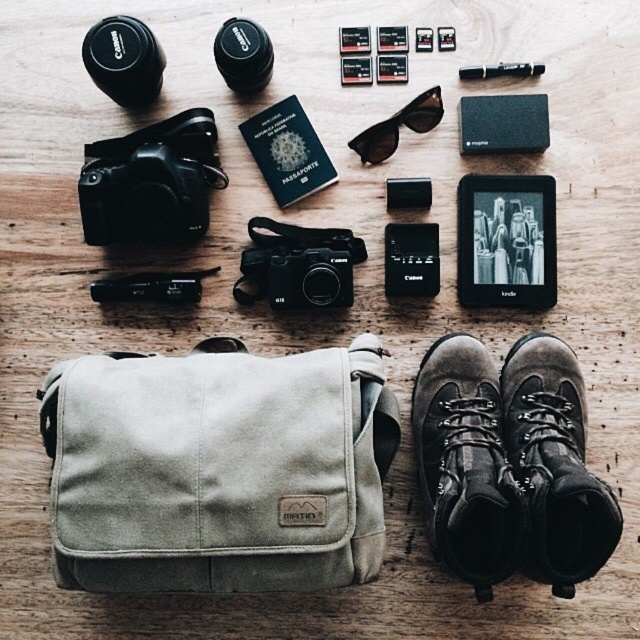
Which of these two, black matte phone at center or metallic pen at upper center, stands taller?

black matte phone at center is taller.

Can you confirm if black matte phone at center is positioned above metallic pen at upper center?

Actually, black matte phone at center is below metallic pen at upper center.

Is point (390, 225) closer to viewer compared to point (532, 67)?

No, (390, 225) is further to viewer.

Where is `black matte phone at center`? black matte phone at center is located at coordinates tap(412, 259).

Who is positioned more to the left, black matte e-reader at center right or black plastic sunglasses at center?

Positioned to the left is black plastic sunglasses at center.

Locate an element on the screen. This screenshot has height=640, width=640. black matte e-reader at center right is located at coordinates (506, 241).

Is point (515, 305) behind point (401, 122)?

Yes.

Find the location of a particular element. This screenshot has width=640, height=640. black matte e-reader at center right is located at coordinates (506, 241).

Does black leather boot at lower right have a greater height compared to black matte e-reader at center right?

Yes.

Between black leather boot at lower right and black matte e-reader at center right, which one has less height?

black matte e-reader at center right

Does point (520, 422) come in front of point (520, 276)?

Yes, it is in front of point (520, 276).

Image resolution: width=640 pixels, height=640 pixels. What are the coordinates of `black leather boot at lower right` in the screenshot? It's located at (554, 465).